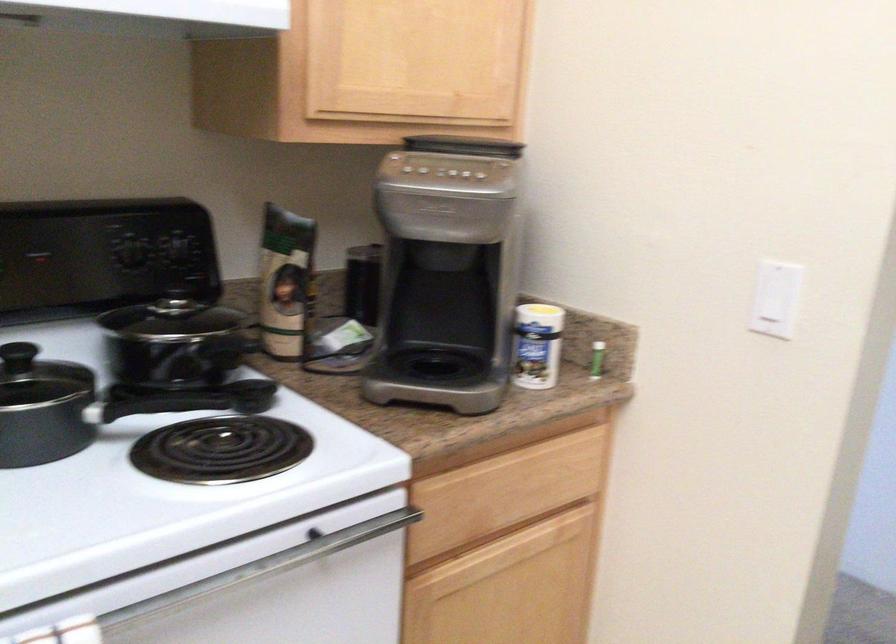
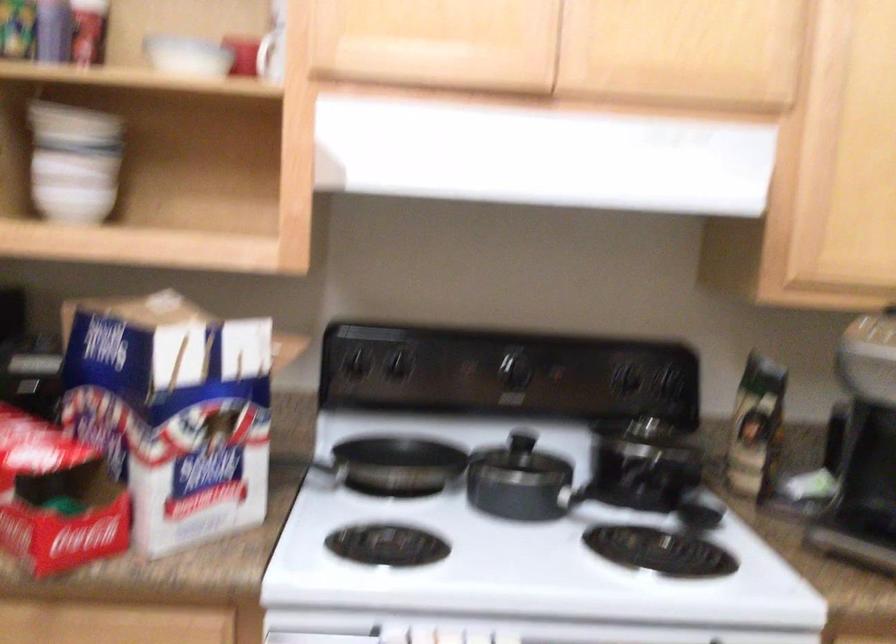
Question: The camera is either moving clockwise (left) or counter-clockwise (right) around the object. The first image is from the beginning of the video and the second image is from the end. Is the camera moving left or right when shooting the video?

Choices:
 (A) Left
 (B) Right

Answer: (B)